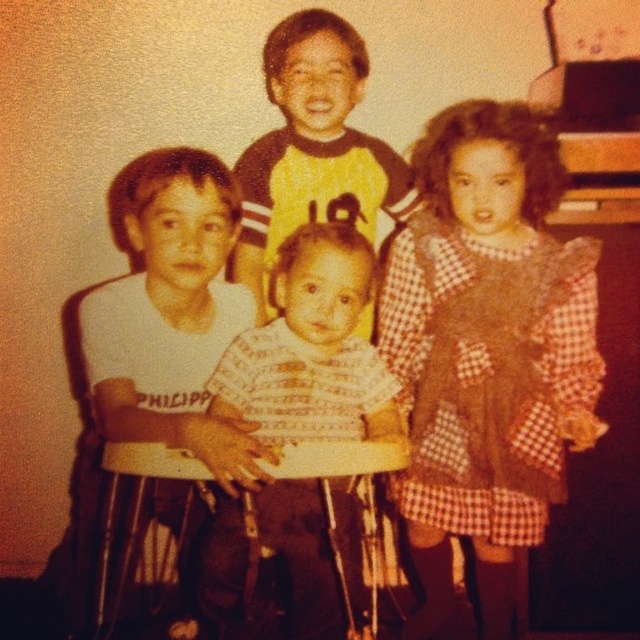
You are standing in front of the vintage photograph of the five children. There are two points marked in the image. One is at coordinate point (145, 228) and the other is at point (328, 113). Which of these two points is closer to you?

Point (145, 228) is closer to the viewer than point (328, 113).

Based on the provided scene description, what object is located at the coordinate point (310, 348)?

The white striped shirt at center is located at the coordinate point (310, 348).